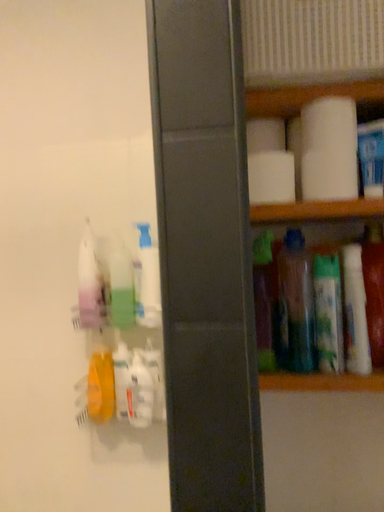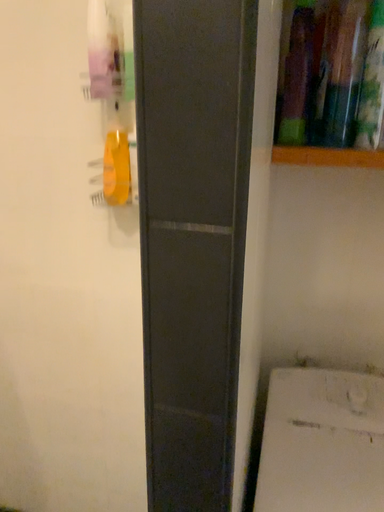
Question: Which way did the camera rotate in the video?

Choices:
 (A) rotated upward
 (B) rotated downward

Answer: (B)